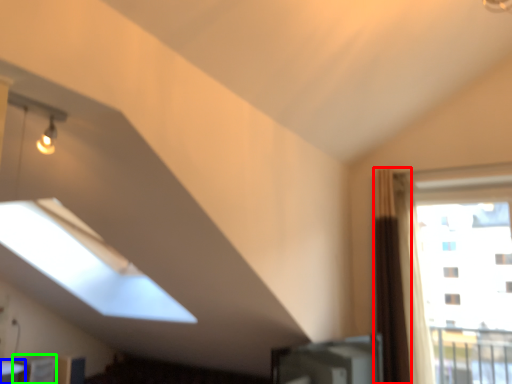
Question: Considering the real-world distances, which object is farthest from curtain (highlighted by a red box)? table (highlighted by a blue box) or furniture (highlighted by a green box)?

Choices:
 (A) table
 (B) furniture

Answer: (A)